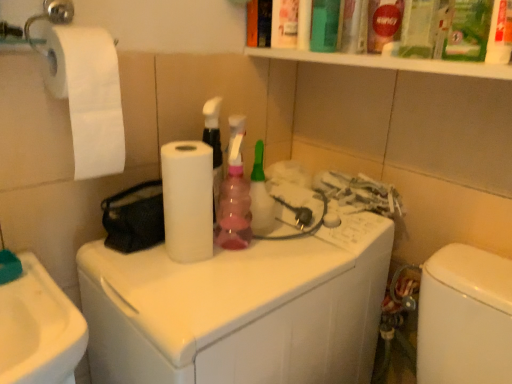
Question: Does pink plastic spray bottle at center have a greater height compared to white matte paper towel at center?

Choices:
 (A) no
 (B) yes

Answer: (B)

Question: Is pink plastic spray bottle at center touching white matte paper towel at center?

Choices:
 (A) no
 (B) yes

Answer: (A)

Question: Does pink plastic spray bottle at center have a smaller size compared to white matte paper towel at center?

Choices:
 (A) yes
 (B) no

Answer: (A)

Question: From the image's perspective, is pink plastic spray bottle at center on top of white matte paper towel at center?

Choices:
 (A) no
 (B) yes

Answer: (B)

Question: From a real-world perspective, is pink plastic spray bottle at center beneath white matte paper towel at center?

Choices:
 (A) no
 (B) yes

Answer: (A)

Question: Considering the relative positions of pink plastic spray bottle at center and white matte paper towel at center in the image provided, is pink plastic spray bottle at center to the right of white matte paper towel at center from the viewer's perspective?

Choices:
 (A) no
 (B) yes

Answer: (B)

Question: Is white glossy washing machine at center not inside white matte paper towel at center?

Choices:
 (A) yes
 (B) no

Answer: (A)

Question: Considering the relative sizes of white glossy washing machine at center and white matte paper towel at center in the image provided, is white glossy washing machine at center taller than white matte paper towel at center?

Choices:
 (A) no
 (B) yes

Answer: (B)

Question: Is white glossy washing machine at center beside white matte paper towel at center?

Choices:
 (A) yes
 (B) no

Answer: (B)

Question: Does white glossy washing machine at center have a greater width compared to white matte paper towel at center?

Choices:
 (A) yes
 (B) no

Answer: (A)

Question: From a real-world perspective, does white glossy washing machine at center sit lower than white matte paper towel at center?

Choices:
 (A) yes
 (B) no

Answer: (A)

Question: Is white glossy washing machine at center behind white matte paper towel at center?

Choices:
 (A) no
 (B) yes

Answer: (A)

Question: Is white matte paper towel at center to the left of white glossy washing machine at center from the viewer's perspective?

Choices:
 (A) no
 (B) yes

Answer: (B)